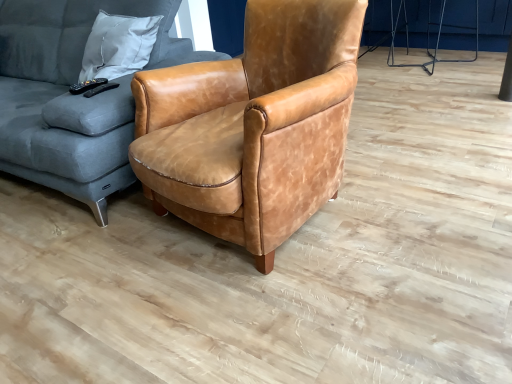
Question: Does velvet grey couch at left have a lesser width compared to matte brown leather armchair at center?

Choices:
 (A) yes
 (B) no

Answer: (B)

Question: Considering the relative sizes of velvet grey couch at left and matte brown leather armchair at center in the image provided, is velvet grey couch at left taller than matte brown leather armchair at center?

Choices:
 (A) yes
 (B) no

Answer: (A)

Question: Considering the relative positions of velvet grey couch at left and matte brown leather armchair at center in the image provided, is velvet grey couch at left to the left of matte brown leather armchair at center from the viewer's perspective?

Choices:
 (A) yes
 (B) no

Answer: (A)

Question: Does velvet grey couch at left appear on the right side of matte brown leather armchair at center?

Choices:
 (A) yes
 (B) no

Answer: (B)

Question: From the image's perspective, does velvet grey couch at left appear higher than matte brown leather armchair at center?

Choices:
 (A) yes
 (B) no

Answer: (A)

Question: Is matte brown leather armchair at center located within velvet grey couch at left?

Choices:
 (A) no
 (B) yes

Answer: (A)

Question: Is matte brown leather armchair at center in contact with velvet grey couch at left?

Choices:
 (A) no
 (B) yes

Answer: (A)

Question: Does matte brown leather armchair at center lie in front of velvet grey couch at left?

Choices:
 (A) no
 (B) yes

Answer: (B)

Question: From a real-world perspective, is matte brown leather armchair at center positioned over velvet grey couch at left based on gravity?

Choices:
 (A) yes
 (B) no

Answer: (B)

Question: Is matte brown leather armchair at center wider than velvet grey couch at left?

Choices:
 (A) no
 (B) yes

Answer: (A)

Question: Considering the relative sizes of matte brown leather armchair at center and velvet grey couch at left in the image provided, is matte brown leather armchair at center taller than velvet grey couch at left?

Choices:
 (A) yes
 (B) no

Answer: (B)

Question: Can you confirm if matte brown leather armchair at center is thinner than velvet grey couch at left?

Choices:
 (A) no
 (B) yes

Answer: (B)

Question: From a real-world perspective, is matte brown leather armchair at center on top of metallic silver tripod at upper right?

Choices:
 (A) no
 (B) yes

Answer: (B)